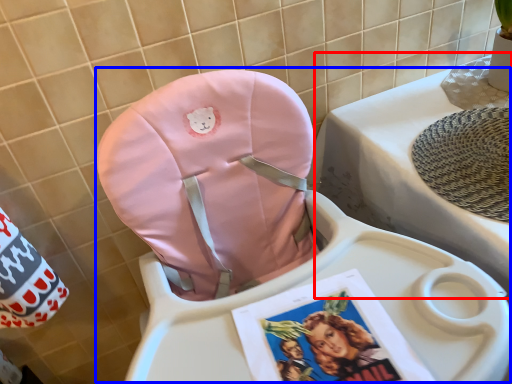
Question: Which of the following is the farthest to the observer, changing table (highlighted by a red box) or baby carriage (highlighted by a blue box)?

Choices:
 (A) changing table
 (B) baby carriage

Answer: (A)